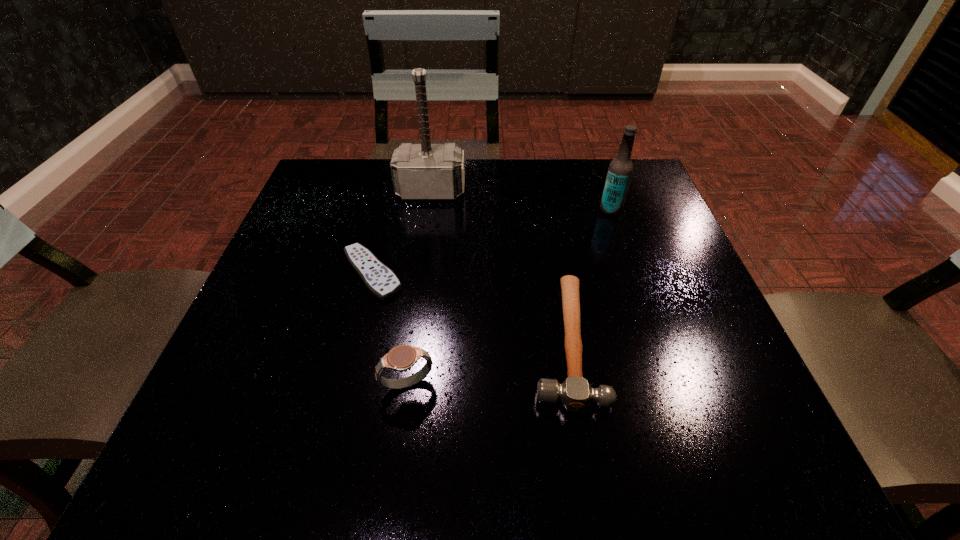
You are a GUI agent. You are given a task and a screenshot of the screen. Output one action in this format:
    pyautogui.click(x=<x>, y=<y>)
    Task: Click on the vacant point located between the remote control and the rightmost object
    
    Given the screenshot: What is the action you would take?
    pyautogui.click(x=492, y=242)

I want to click on free point between the watch and the second shortest object, so click(x=486, y=362).

The image size is (960, 540). Find the location of `empty space between the rightmost object and the remote control`. empty space between the rightmost object and the remote control is located at coordinates pos(492,242).

This screenshot has height=540, width=960. Identify the location of free space between the nearer hammer and the rightmost object. (588, 275).

Where is `free space that is in between the remote control and the watch`? free space that is in between the remote control and the watch is located at coordinates (390, 329).

I want to click on free space between the shorter hammer and the farther hammer, so click(x=497, y=266).

Identify which object is the fourth nearest to the fourth tallest object. Please provide its 2D coordinates. Your answer should be formatted as a tuple, i.e. [(x, y)], where the tuple contains the x and y coordinates of a point satisfying the conditions above.

[(425, 171)]

Identify which object is the nearest to the watch. Please provide its 2D coordinates. Your answer should be formatted as a tuple, i.e. [(x, y)], where the tuple contains the x and y coordinates of a point satisfying the conditions above.

[(379, 279)]

At what (x,y) coordinates should I click in order to perform the action: click on free location that satisfies the following two spatial constraints: 1. on the front side of the shorter hammer; 2. on the right side of the shortest object. Please return your answer as a coordinate pair (x, y). The height and width of the screenshot is (540, 960). Looking at the image, I should click on (355, 340).

Identify the location of blank space that satisfies the following two spatial constraints: 1. for striking with the head of the nearer hammer; 2. on the left side of the taller hammer. tap(411, 340).